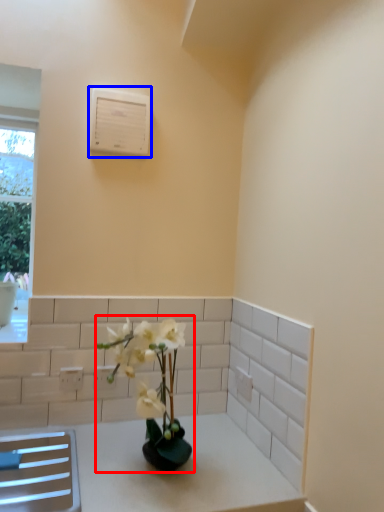
Question: Which object is closer to the camera taking this photo, houseplant (highlighted by a red box) or air conditioning (highlighted by a blue box)?

Choices:
 (A) houseplant
 (B) air conditioning

Answer: (A)